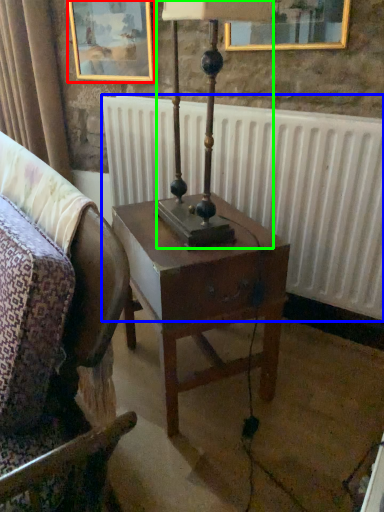
Question: Which object is the closest to the picture frame (highlighted by a red box)? Choose among these: radiator (highlighted by a blue box) or bedside lamp (highlighted by a green box).

Choices:
 (A) radiator
 (B) bedside lamp

Answer: (A)